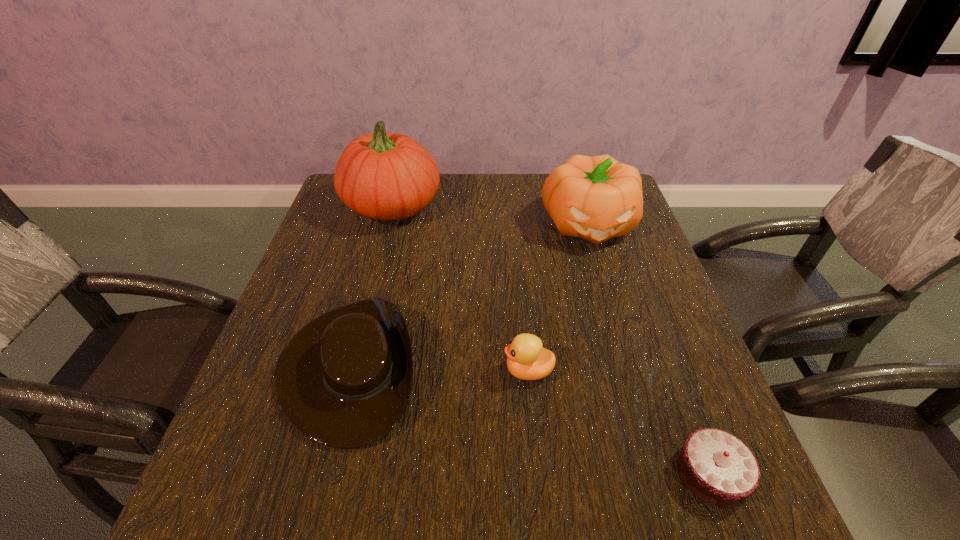
Where is `free space that is in between the cowboy hat and the third object from left to right`? The image size is (960, 540). free space that is in between the cowboy hat and the third object from left to right is located at coordinates (439, 369).

Where is `free spot between the duckling and the cowboy hat`? free spot between the duckling and the cowboy hat is located at coordinates (439, 369).

The width and height of the screenshot is (960, 540). I want to click on free space between the third tallest object and the shorter pumpkin, so click(x=559, y=298).

Locate an element on the screen. blank region between the cowboy hat and the chocolate cake is located at coordinates (530, 421).

Locate an element on the screen. The height and width of the screenshot is (540, 960). empty space that is in between the cowboy hat and the chocolate cake is located at coordinates (530, 421).

You are a GUI agent. You are given a task and a screenshot of the screen. Output one action in this format:
    pyautogui.click(x=<x>, y=<y>)
    Task: Click on the free space that is in between the second tallest object and the chocolate cake
    
    Given the screenshot: What is the action you would take?
    pyautogui.click(x=650, y=349)

Find the location of a particular element. This screenshot has width=960, height=540. vacant space in between the duckling and the chocolate cake is located at coordinates (620, 422).

This screenshot has height=540, width=960. Identify the location of the third closest object relative to the duckling. (596, 198).

Locate an element on the screen. The image size is (960, 540). object that ranks as the second closest to the chocolate cake is located at coordinates (344, 380).

Image resolution: width=960 pixels, height=540 pixels. Identify the location of vacant space that satisfies the following two spatial constraints: 1. on the front side of the chocolate cake; 2. on the right side of the cowboy hat. (322, 473).